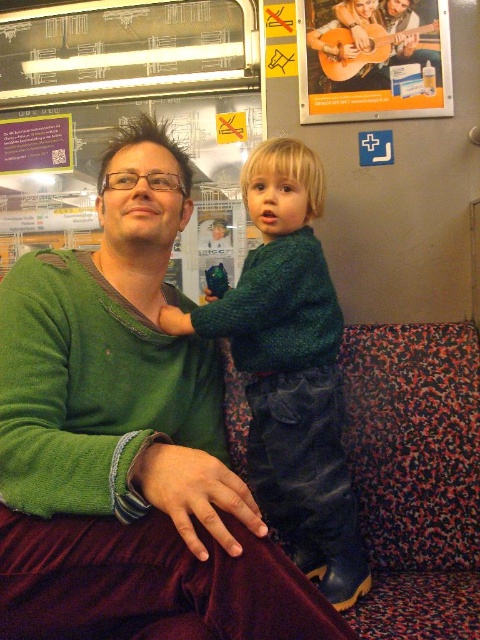
Can you confirm if green fuzzy sweater at center is taller than dark green sweater at center?

No.

Consider the image. Is green fuzzy sweater at center above dark green sweater at center?

Correct, green fuzzy sweater at center is located above dark green sweater at center.

Does point (94, 493) lie behind point (308, 513)?

No.

Identify the location of green fuzzy sweater at center. [128, 442].

Between point (297, 296) and point (300, 109), which one is positioned behind?

Point (300, 109)

How distant is dark green sweater at center from wooden guitar at upper center?

dark green sweater at center is 27.56 inches away from wooden guitar at upper center.

Where is `dark green sweater at center`? dark green sweater at center is located at coordinates (290, 369).

Which is more to the left, green fuzzy sweater at center or wooden guitar at upper center?

green fuzzy sweater at center

Can you confirm if green fuzzy sweater at center is wider than wooden guitar at upper center?

Yes.

Which is in front, point (15, 556) or point (357, 19)?

Point (15, 556) is in front.

At what (x,y) coordinates should I click in order to perform the action: click on green fuzzy sweater at center. Please return your answer as a coordinate pair (x, y). The height and width of the screenshot is (640, 480). Looking at the image, I should click on (128, 442).